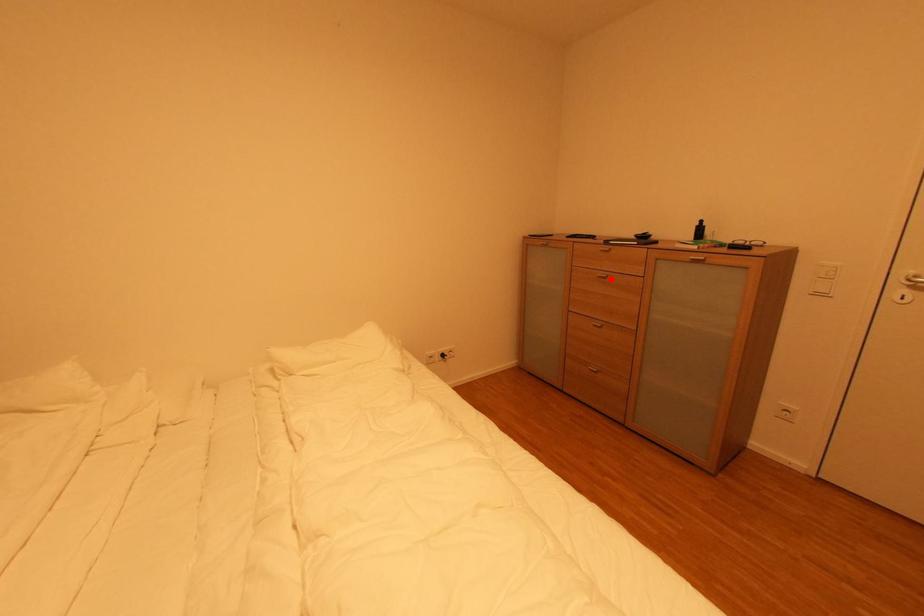
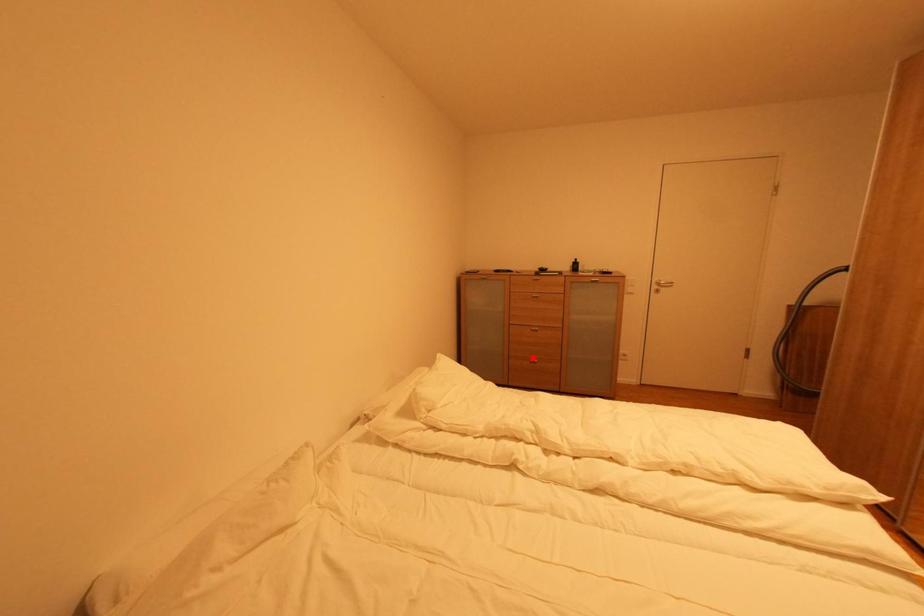
I am providing you with two images of the same scene from different viewpoints. A red point is marked on the first image and another point is marked on the second image. Is the marked point in image1 the same physical position as the marked point in image2?

No